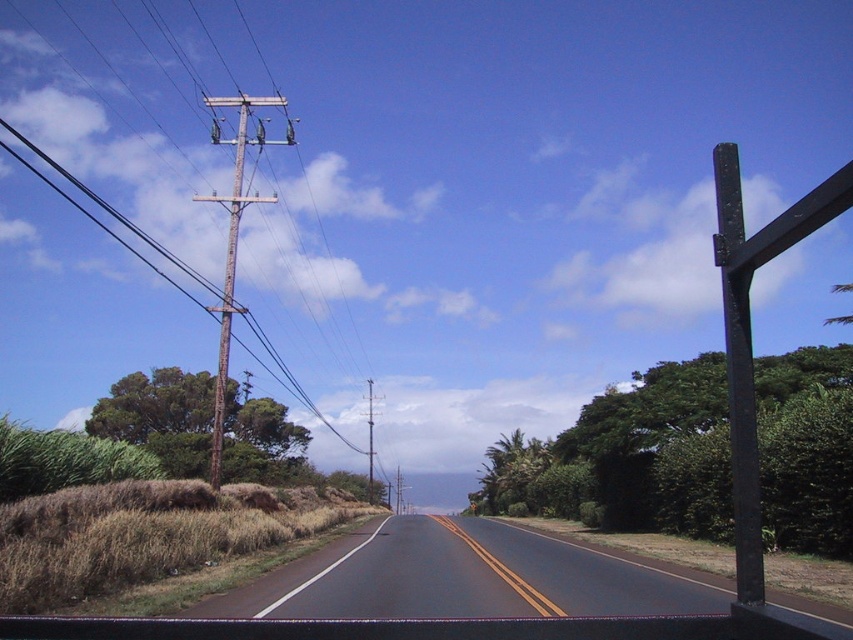
Question: Which point is farther to the camera?

Choices:
 (A) rusty wood telegraph pole at left
 (B) green rough bark tree at left

Answer: (B)

Question: Can you confirm if rusty wood pole at left is positioned below rusty wood telegraph pole at left?

Choices:
 (A) yes
 (B) no

Answer: (B)

Question: Does black asphalt road at center appear on the right side of rusty wood telegraph pole at left?

Choices:
 (A) no
 (B) yes

Answer: (B)

Question: Is rusty wood pole at left closer to the viewer compared to green leafy tree at right?

Choices:
 (A) no
 (B) yes

Answer: (A)

Question: Which point is closer to the camera?

Choices:
 (A) (758, 369)
 (B) (54, 356)
 (C) (231, 468)
 (D) (221, 387)

Answer: (D)

Question: Estimate the real-world distances between objects in this image. Which object is farther from the green rough bark tree at left?

Choices:
 (A) rusty wood telegraph pole at left
 (B) black asphalt road at center
 (C) rusty wood pole at left
 (D) green leafy tree at right

Answer: (C)